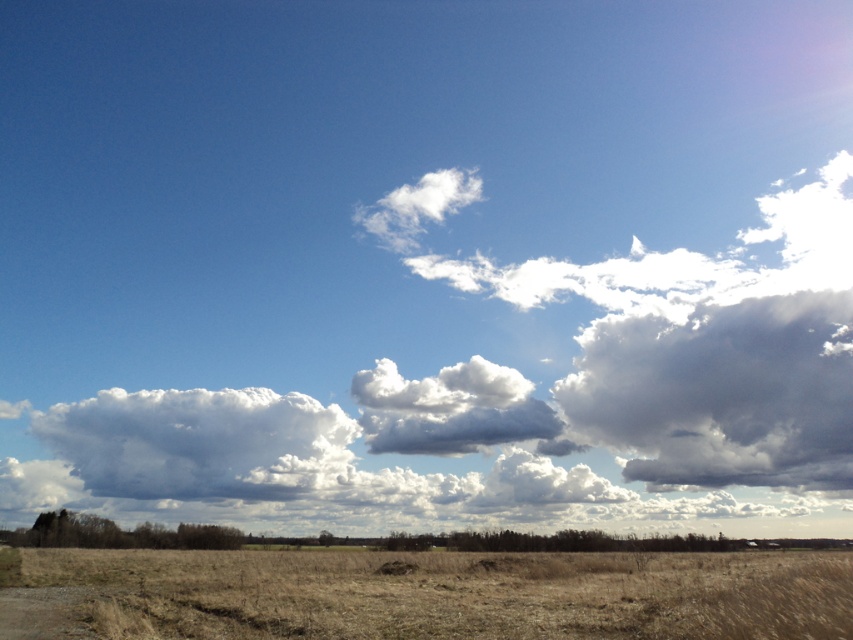
You are a hiker standing at the edge of the dry grassy field. You see the cloudy gray at upper right and the brown dirt track at lower left. Which object is higher in the sky compared to the other?

The cloudy gray at upper right is much taller than the brown dirt track at lower left.

You are standing in the rural landscape and want to walk from point (170, 435) to point (41, 627). Which direction should you face to move towards the latter?

You should face towards the lower right direction because point (41, 627) is closer to the camera than point (170, 435), meaning it is located lower and further to the right in the image.

You are an airplane pilot flying over the rural landscape. You notice the white fluffy cloud at upper center and the brown grassland at lower center. Which object appears bigger from your aerial view?

The white fluffy cloud at upper center appears bigger than the brown grassland at lower center because it has a larger size compared to the brown grassland at lower center.